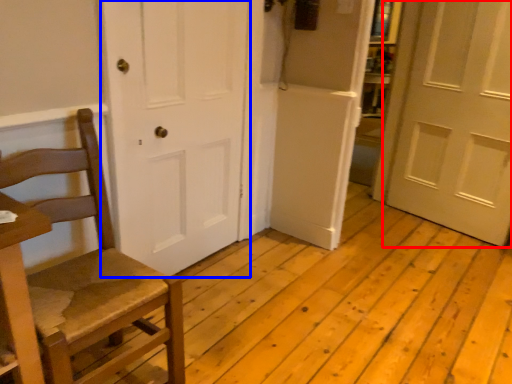
Question: Among these objects, which one is farthest to the camera, door (highlighted by a red box) or door (highlighted by a blue box)?

Choices:
 (A) door
 (B) door

Answer: (A)